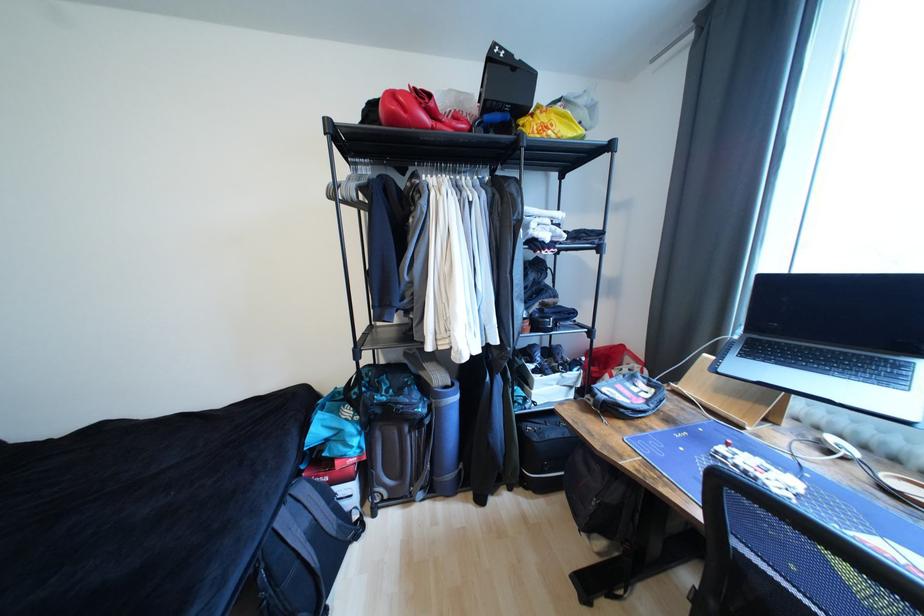
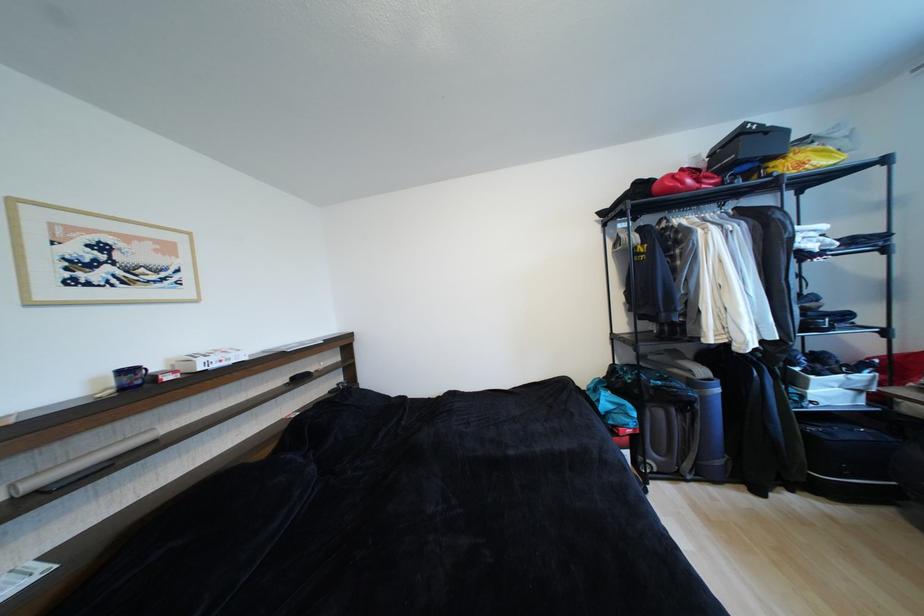
The point at (528,122) is marked in the first image. Where is the corresponding point in the second image?

(780, 166)